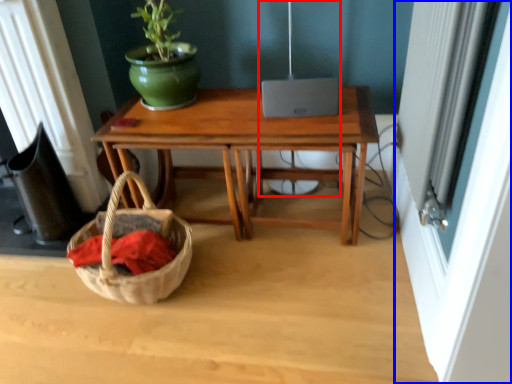
Question: Which object appears closest to the camera in this image, lamp (highlighted by a red box) or screen door (highlighted by a blue box)?

Choices:
 (A) lamp
 (B) screen door

Answer: (B)